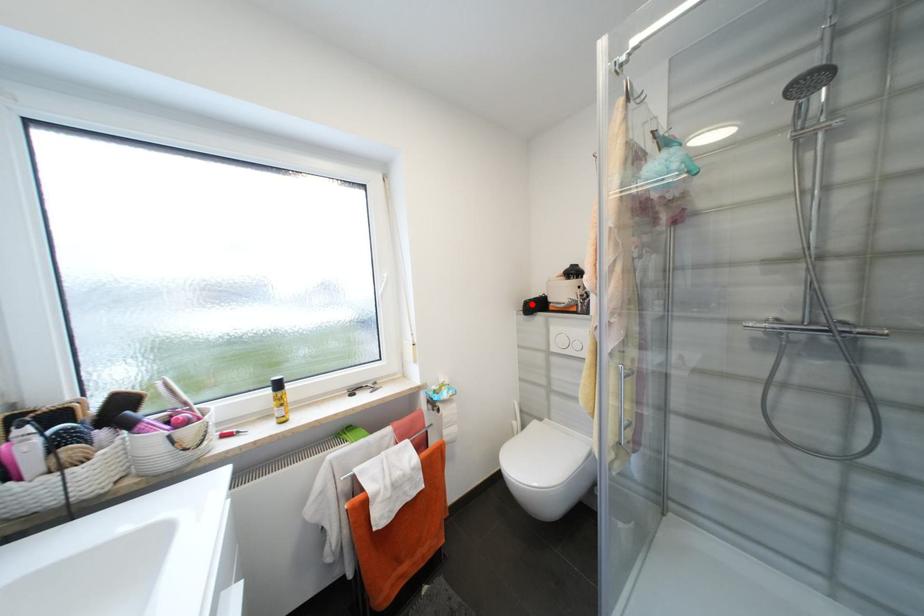
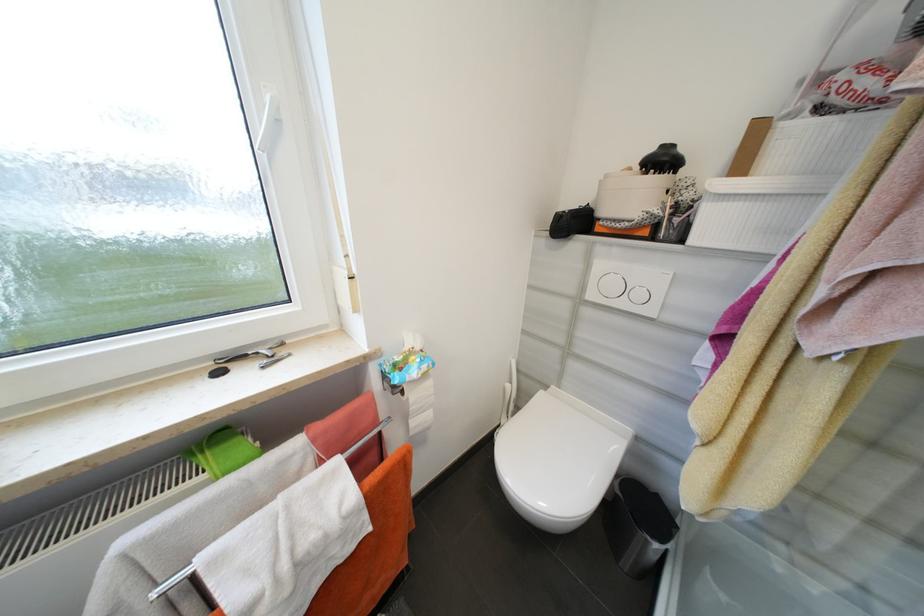
In the second image, find the point that corresponds to the highlighted location in the first image.

(565, 217)